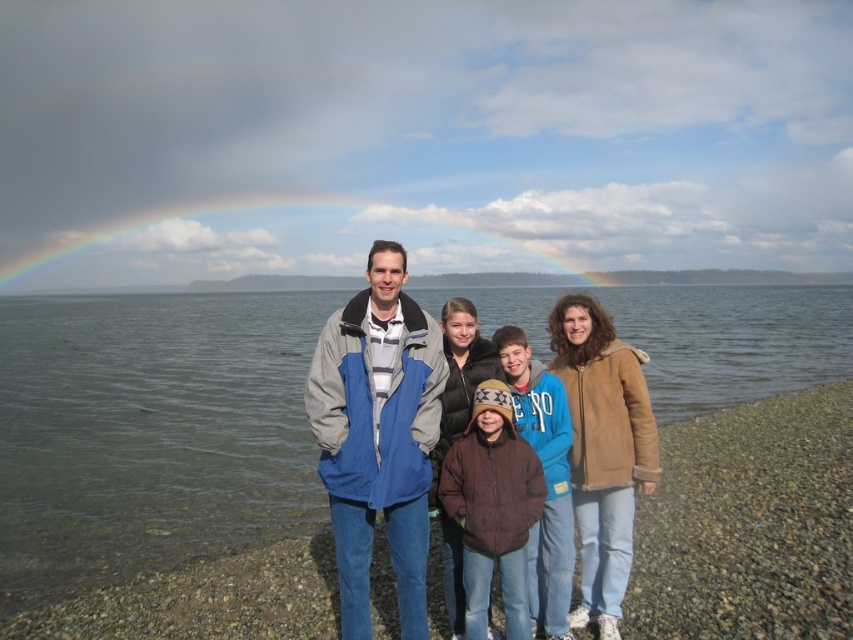
You are a photographer trying to capture a group photo of the two adults and three children. You notice the blue and gray jacket at center and the brown fuzzy jacket at center. Which jacket should you adjust in the frame to ensure both jackets are equally visible? Explain your reasoning.

The blue and gray jacket at center is wider than the brown fuzzy jacket at center. To ensure both are equally visible, adjust the brown fuzzy jacket at center to move it closer to the camera or widen its position to match the width of the blue and gray jacket at center.

You are standing at the origin point of the image coordinate system. You want to locate the blue and gray jacket at center. What are its coordinates?

The coordinates of the blue and gray jacket at center are at point (378, 435).